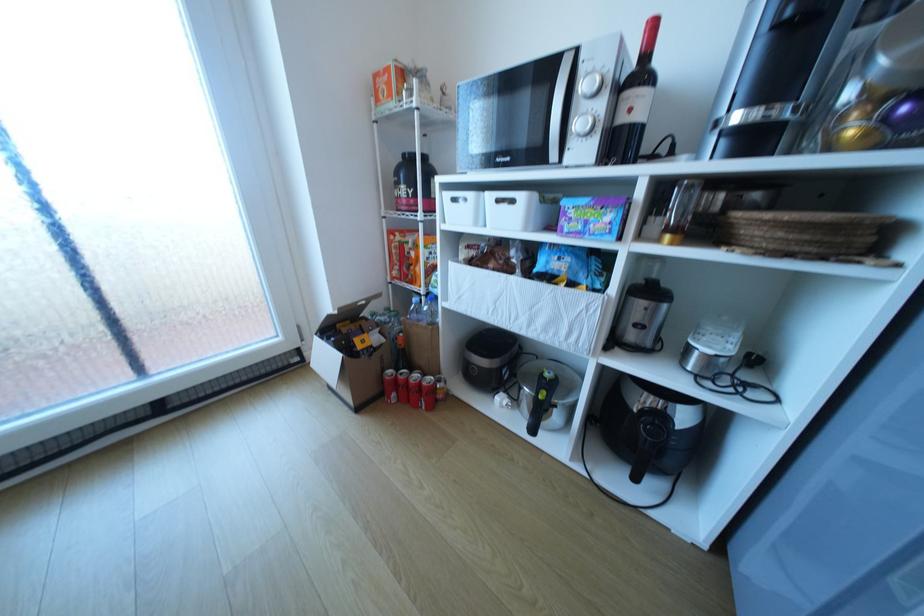
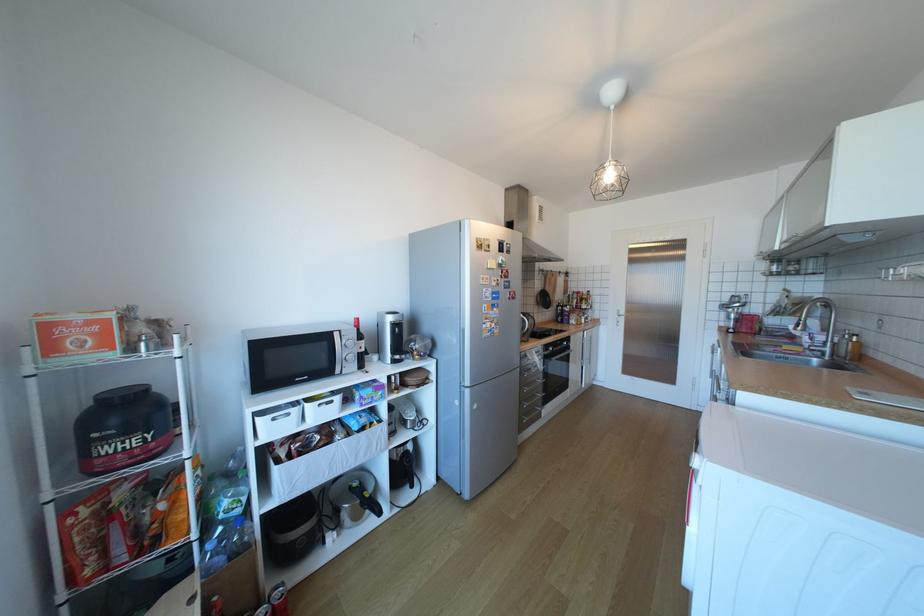
Locate, in the second image, the point that corresponds to point (464, 201) in the first image.

(283, 419)